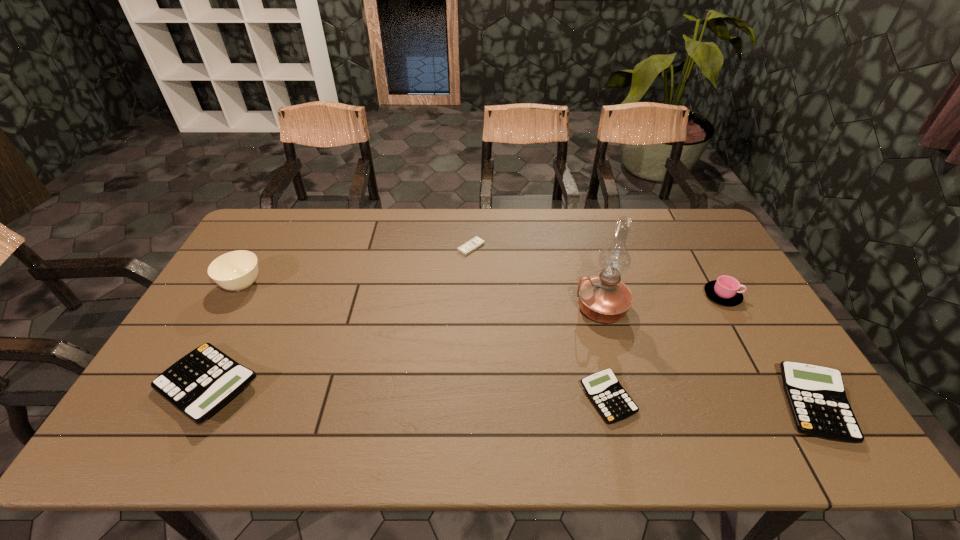
Locate an element on the screen. This screenshot has height=540, width=960. free space between the second shortest object and the sixth shortest object is located at coordinates tap(425, 342).

This screenshot has width=960, height=540. I want to click on vacant region between the fifth object from right to left and the shortest calculator, so click(540, 323).

Image resolution: width=960 pixels, height=540 pixels. What are the coordinates of `free space between the shortest calculator and the fifth object from right to left` in the screenshot? It's located at (540, 323).

Identify the location of vacant space that is in between the leftmost calculator and the shortest calculator. Image resolution: width=960 pixels, height=540 pixels. (408, 393).

The height and width of the screenshot is (540, 960). Find the location of `free space between the fifth tallest object and the shortest calculator`. free space between the fifth tallest object and the shortest calculator is located at coordinates (711, 402).

Where is `empty space between the second tallest object and the leftmost calculator`? The height and width of the screenshot is (540, 960). empty space between the second tallest object and the leftmost calculator is located at coordinates (226, 336).

Image resolution: width=960 pixels, height=540 pixels. Identify the location of unoccupied position between the sixth tallest object and the second tallest object. (425, 342).

In order to click on unoccupied position between the shortest calculator and the cup in this screenshot , I will do `click(665, 347)`.

You are a GUI agent. You are given a task and a screenshot of the screen. Output one action in this format:
    pyautogui.click(x=<x>, y=<y>)
    Task: Click on the object that is the third closest to the shortest object
    This screenshot has width=960, height=540.
    Given the screenshot: What is the action you would take?
    pyautogui.click(x=236, y=271)

Point out which object is positioned as the fifth nearest to the tallest object. Please provide its 2D coordinates. Your answer should be formatted as a tuple, i.e. [(x, y)], where the tuple contains the x and y coordinates of a point satisfying the conditions above.

[(200, 383)]